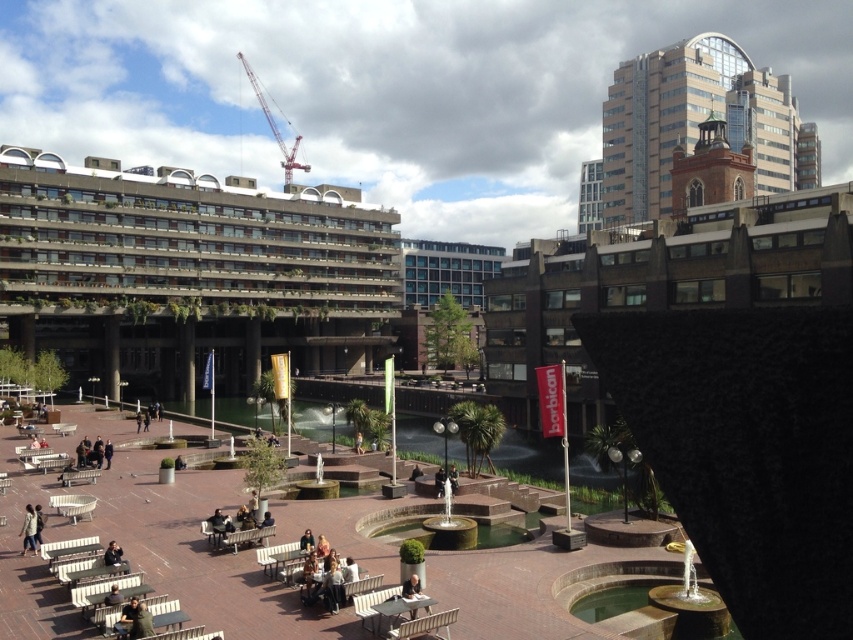
Question: Which object is positioned closest to the smooth stone fountain at center?

Choices:
 (A) dark brown leather jacket at lower left
 (B) light brown wooden chair at lower center
 (C) red metallic crane at upper center
 (D) dark gray jacket at center

Answer: (B)

Question: Observing the image, what is the correct spatial positioning of smooth stone fountain at center in reference to light brown leather jacket at lower left?

Choices:
 (A) left
 (B) right

Answer: (B)

Question: Can you confirm if smooth stone fountain at center is bigger than dark gray jacket at center?

Choices:
 (A) no
 (B) yes

Answer: (B)

Question: Considering the real-world distances, which object is closest to the red metallic crane at upper center?

Choices:
 (A) dark gray jacket at center
 (B) dark brown leather jacket at lower left
 (C) light brown wooden chair at lower center
 (D) light brown leather jacket at lower left

Answer: (B)

Question: Which point is farther to the camera?

Choices:
 (A) dark gray jacket at center
 (B) red metallic crane at upper center
 (C) light brown wooden chair at lower center
 (D) light brown leather jacket at lower left

Answer: (B)

Question: Is red metallic crane at upper center above dark gray jacket at center?

Choices:
 (A) no
 (B) yes

Answer: (B)